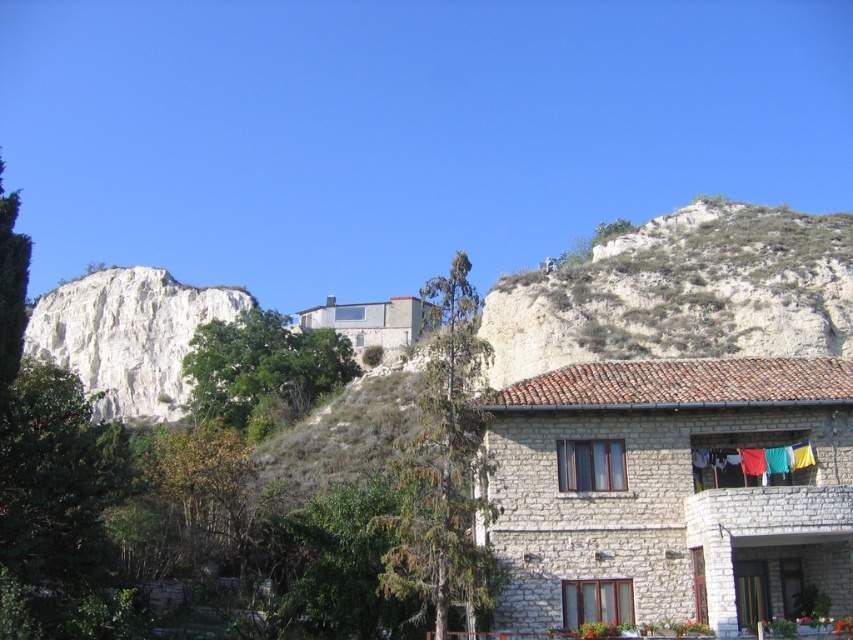
Question: Does green leafy tree at center have a smaller size compared to green leafy tree at upper center?

Choices:
 (A) no
 (B) yes

Answer: (B)

Question: Based on their relative distances, which object is nearer to the green leafy tree at upper center?

Choices:
 (A) green fabric clothes at lower right
 (B) green leafy tree at center

Answer: (B)

Question: Does green leafy tree at center have a smaller size compared to green fabric clothes at lower right?

Choices:
 (A) no
 (B) yes

Answer: (A)

Question: Considering the real-world distances, which object is farthest from the green fabric clothes at lower right?

Choices:
 (A) green leafy tree at upper center
 (B) green leafy tree at center

Answer: (A)

Question: Does green leafy tree at upper center appear on the left side of green fabric clothes at lower right?

Choices:
 (A) no
 (B) yes

Answer: (B)

Question: Which point is farther to the camera?

Choices:
 (A) green leafy tree at upper center
 (B) green leafy tree at center

Answer: (A)